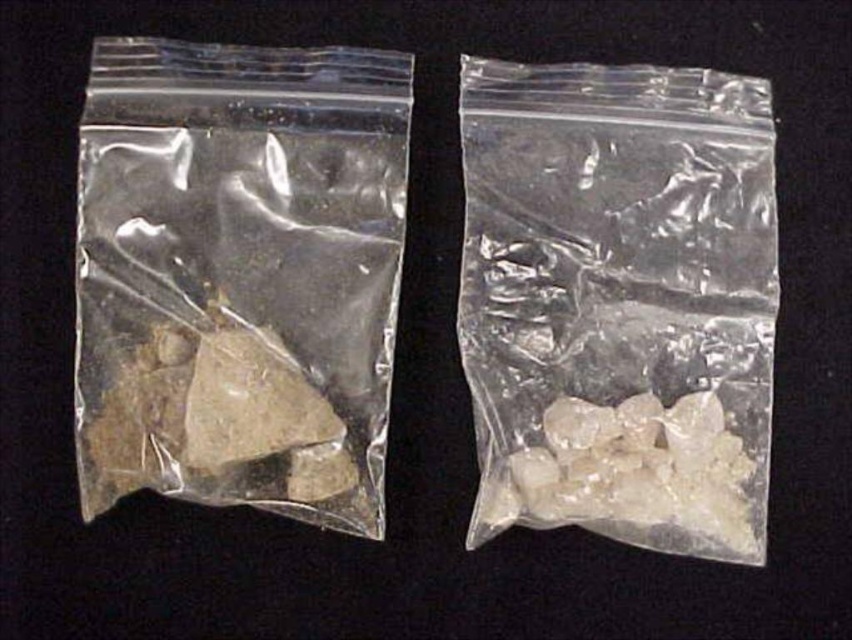
You are organizing items on a shelf and need to place the translucent plastic bag at left and the transparent plastic bag at center. If the shelf has limited space, which bag should you place first to ensure both fit properly?

The translucent plastic bag at left should be placed first since it is positioned to the left of the transparent plastic bag at center, allowing you to arrange them in order from left to right on the shelf.

You are an archaeologist examining the two bags. The point marked at coordinates [239,275] is on which bag?

The point marked at coordinates [239,275] is on the translucent plastic bag at left.

You are organizing a science fair display and need to place the translucent plastic bag at left and the translucent crystal chunks at right on a shelf. If the shelf has limited space and you want to arrange them side by side, which object should be placed first to ensure both fit properly?

The translucent plastic bag at left should be placed first because it is wider than the translucent crystal chunks at right, ensuring there is enough space for both when arranged side by side.